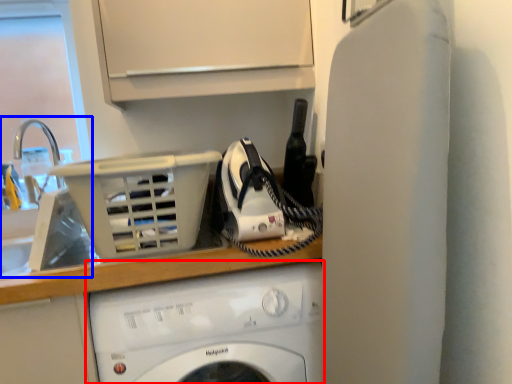
Question: Which object is closer to the camera taking this photo, washing machine (highlighted by a red box) or sink (highlighted by a blue box)?

Choices:
 (A) washing machine
 (B) sink

Answer: (A)